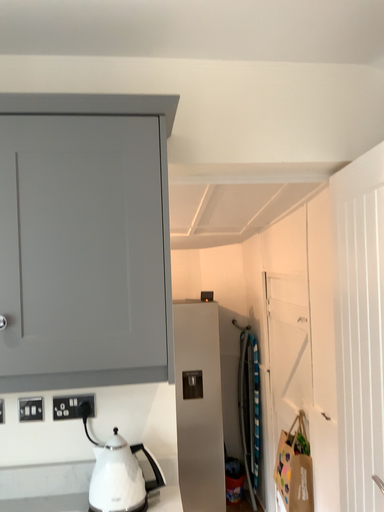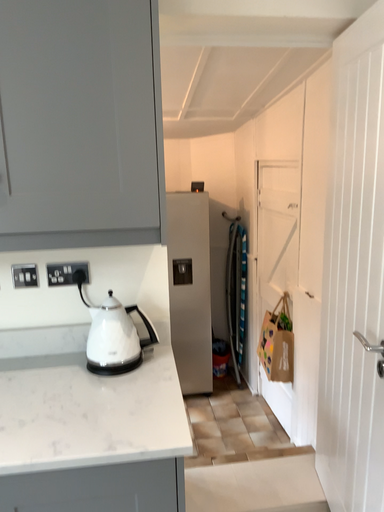
Question: How did the camera likely rotate when shooting the video?

Choices:
 (A) rotated downward
 (B) rotated upward

Answer: (A)